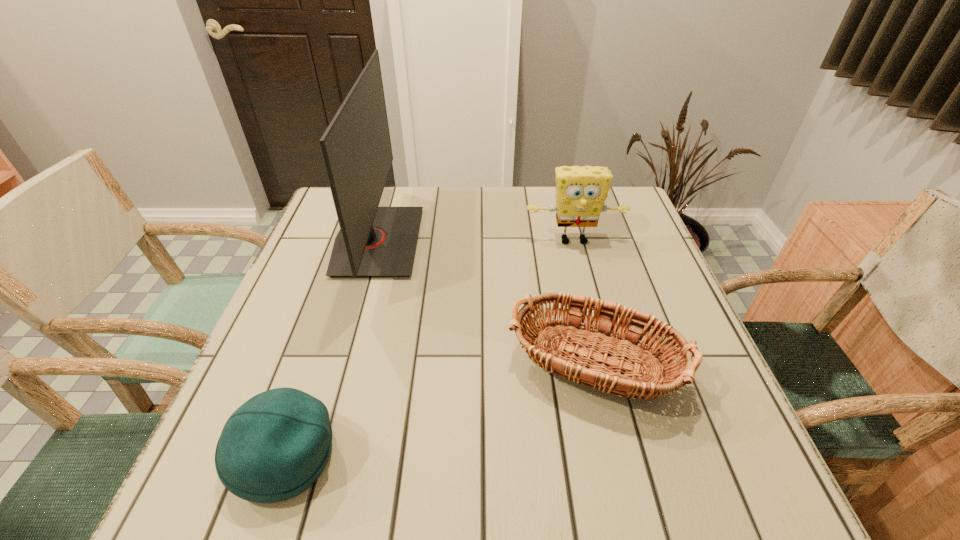
Where is `vacant space at the far edge`? This screenshot has width=960, height=540. vacant space at the far edge is located at coordinates (453, 205).

In the image, there is a desktop. Where is `vacant space at the left edge`? This screenshot has width=960, height=540. vacant space at the left edge is located at coordinates (297, 287).

Locate an element on the screen. Image resolution: width=960 pixels, height=540 pixels. free location at the right edge is located at coordinates (648, 249).

In the image, there is a desktop. At what (x,y) coordinates should I click in order to perform the action: click on vacant space at the far right corner. Please return your answer as a coordinate pair (x, y). Looking at the image, I should click on (624, 189).

Locate an element on the screen. Image resolution: width=960 pixels, height=540 pixels. unoccupied position between the monitor and the basket is located at coordinates (490, 309).

At what (x,y) coordinates should I click in order to perform the action: click on blank region between the basket and the monitor. Please return your answer as a coordinate pair (x, y). Looking at the image, I should click on (490, 309).

I want to click on vacant area that lies between the third shortest object and the tallest object, so click(x=475, y=241).

The height and width of the screenshot is (540, 960). Find the location of `vacant point located between the beanie and the monitor`. vacant point located between the beanie and the monitor is located at coordinates (332, 349).

At what (x,y) coordinates should I click in order to perform the action: click on vacant area between the monitor and the basket. Please return your answer as a coordinate pair (x, y). Looking at the image, I should click on (490, 309).

Locate an element on the screen. The height and width of the screenshot is (540, 960). free space between the beanie and the second tallest object is located at coordinates (430, 348).